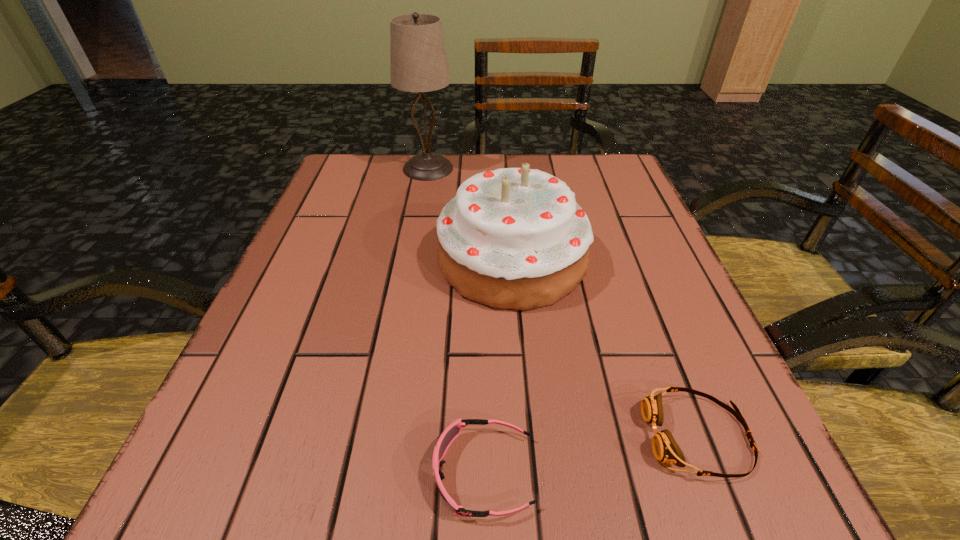
The height and width of the screenshot is (540, 960). Identify the location of free point between the left goggles and the tallest object. (456, 321).

At what (x,y) coordinates should I click in order to perform the action: click on free spot between the left goggles and the second tallest object. Please return your answer as a coordinate pair (x, y). The image size is (960, 540). Looking at the image, I should click on (498, 366).

Locate which object is the closest to the right goggles. Please provide its 2D coordinates. Your answer should be formatted as a tuple, i.e. [(x, y)], where the tuple contains the x and y coordinates of a point satisfying the conditions above.

[(452, 431)]

Locate which object ranks in proximity to the left goggles. Please provide its 2D coordinates. Your answer should be formatted as a tuple, i.e. [(x, y)], where the tuple contains the x and y coordinates of a point satisfying the conditions above.

[(665, 448)]

Find the location of `vacant space that satisfies the following two spatial constraints: 1. on the front-facing side of the farthest object; 2. on the back side of the cake`. vacant space that satisfies the following two spatial constraints: 1. on the front-facing side of the farthest object; 2. on the back side of the cake is located at coordinates (412, 260).

This screenshot has height=540, width=960. Identify the location of free spot that satisfies the following two spatial constraints: 1. on the front-facing side of the second tallest object; 2. on the left side of the farthest object. [412, 260].

You are a GUI agent. You are given a task and a screenshot of the screen. Output one action in this format:
    pyautogui.click(x=<x>, y=<y>)
    Task: Click on the blank area in the image that satisfies the following two spatial constraints: 1. on the front-facing side of the second farthest object; 2. on the right side of the lampshade
    Image resolution: width=960 pixels, height=540 pixels.
    Given the screenshot: What is the action you would take?
    pyautogui.click(x=412, y=260)

Identify the location of vacant space that satisfies the following two spatial constraints: 1. on the front-facing side of the tallest object; 2. on the right side of the second farthest object. Image resolution: width=960 pixels, height=540 pixels. (412, 260).

I want to click on blank space that satisfies the following two spatial constraints: 1. on the front-facing side of the farthest object; 2. on the right side of the second farthest object, so click(x=412, y=260).